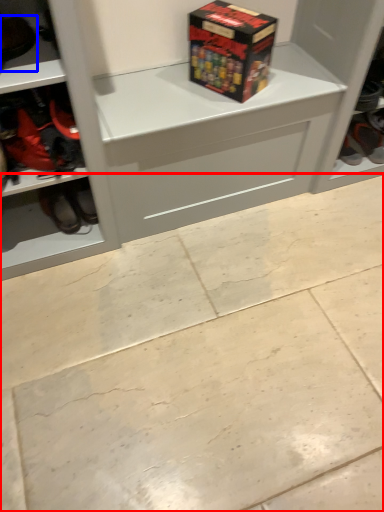
Question: Which of the following is the farthest to the observer, concrete (highlighted by a red box) or footwear (highlighted by a blue box)?

Choices:
 (A) concrete
 (B) footwear

Answer: (B)